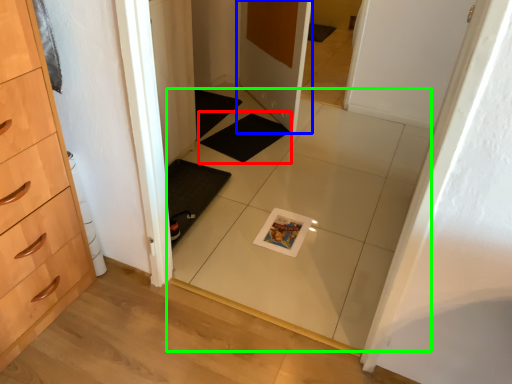
Question: Which object is positioned farthest from bath mat (highlighted by a red box)? Select from door (highlighted by a blue box) and tile (highlighted by a green box).

Choices:
 (A) door
 (B) tile

Answer: (B)